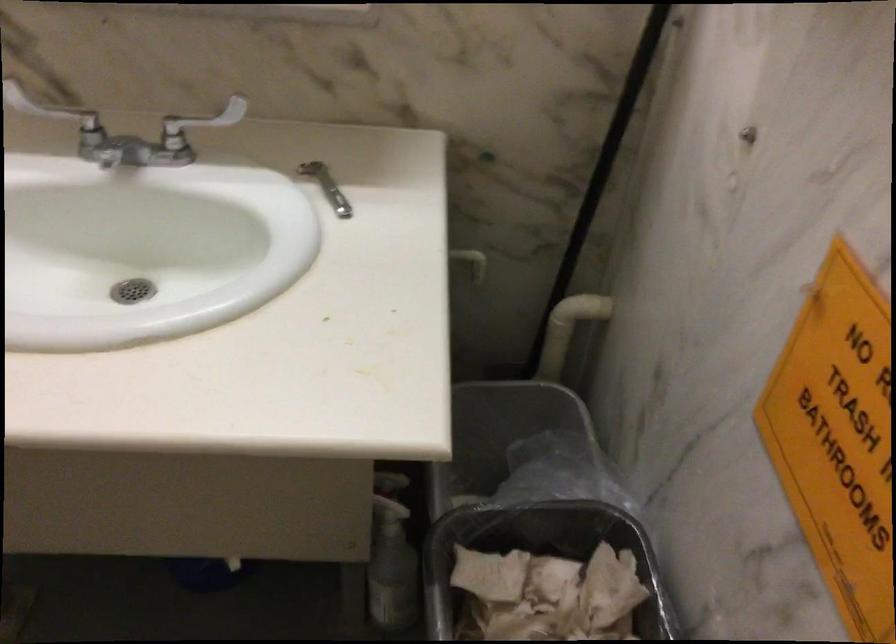
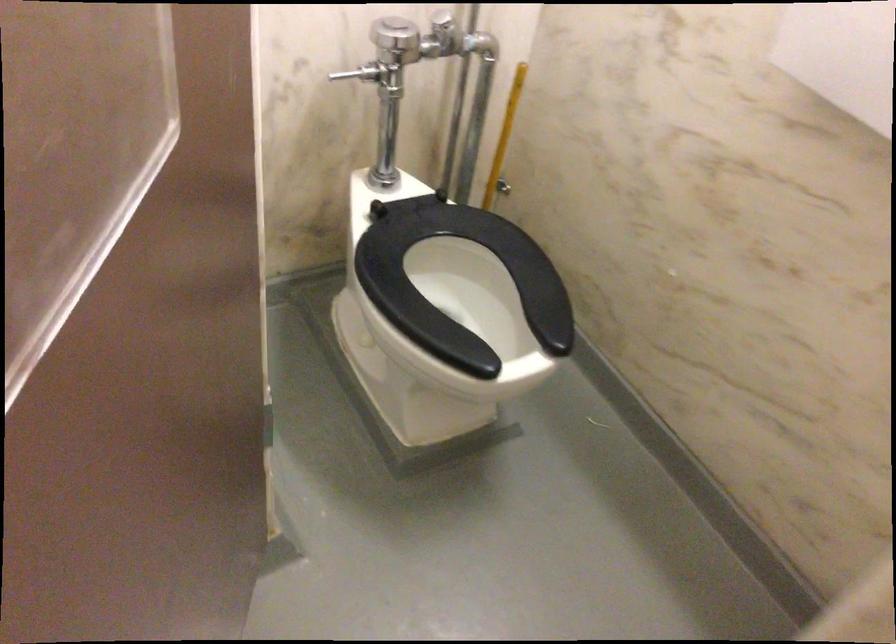
Question: The camera is either moving clockwise (left) or counter-clockwise (right) around the object. The first image is from the beginning of the video and the second image is from the end. Is the camera moving left or right when shooting the video?

Choices:
 (A) Left
 (B) Right

Answer: (B)